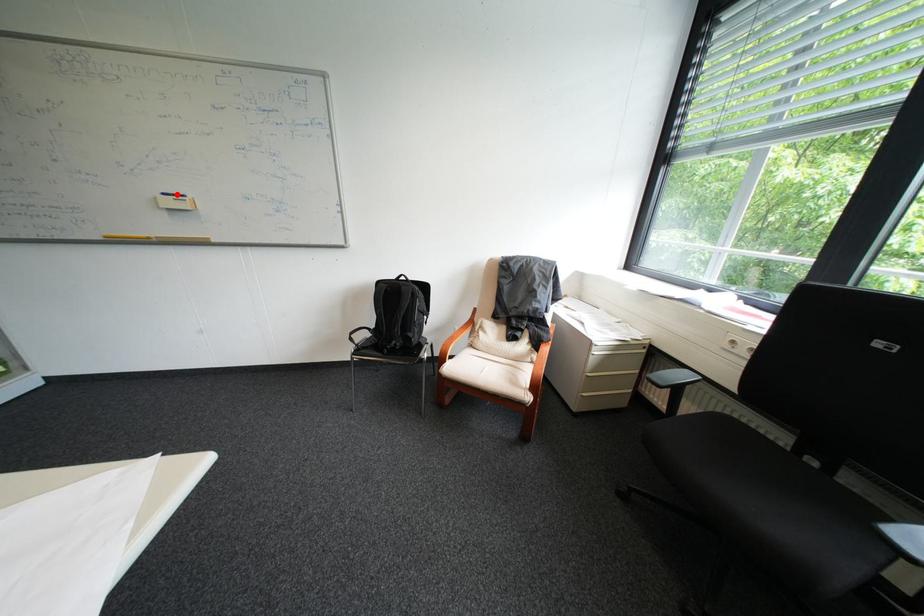
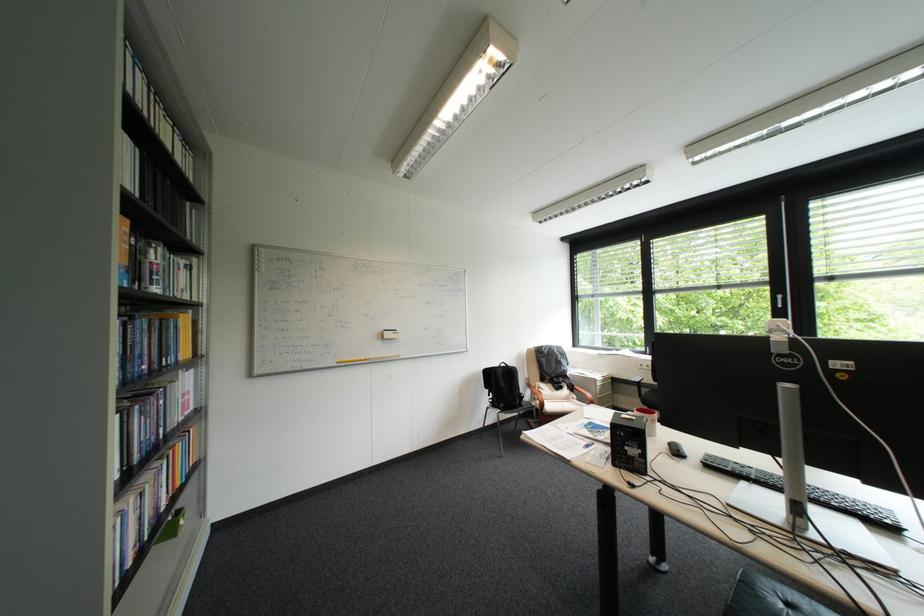
The point at the highlighted location is marked in the first image. Where is the corresponding point in the second image?

(397, 331)